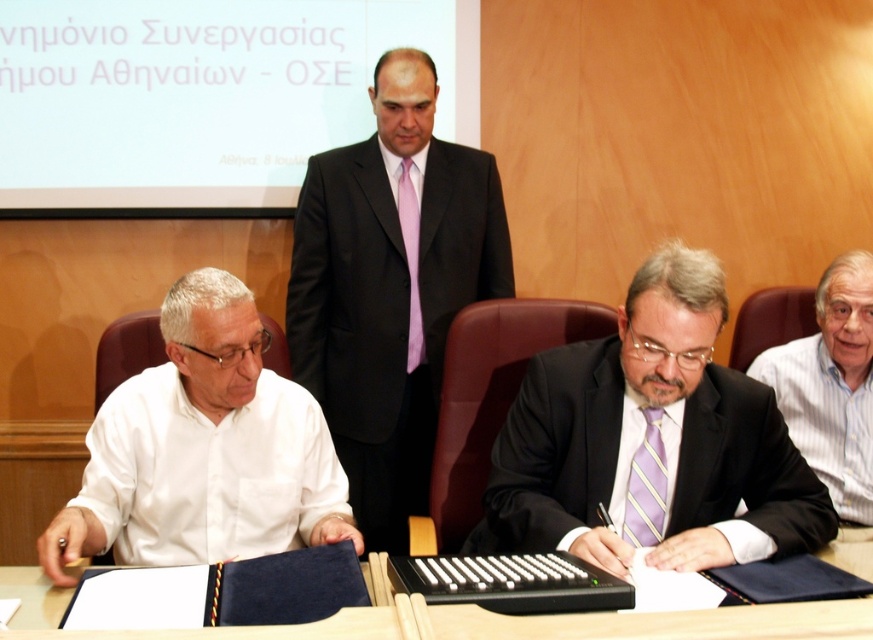
You are a photographer in the room and want to take a photo of both the white shirt at left and the pink silk tie at center. Based on their positions, which one should you focus on first to ensure both are in frame?

The white shirt at left is positioned under the pink silk tie at center, so you should focus on the pink silk tie at center first to ensure both are in frame.

You are organizing a photo shoot and need to ensure that all elements in the scene are proportionally scaled. Given the white striped shirt at right and the dark blue leather table at lower center, which object should be adjusted in size to maintain proper proportions?

The white striped shirt at right has a larger size compared to the dark blue leather table at lower center. To maintain proper proportions, the white striped shirt at right should be resized to match the scale of the table.